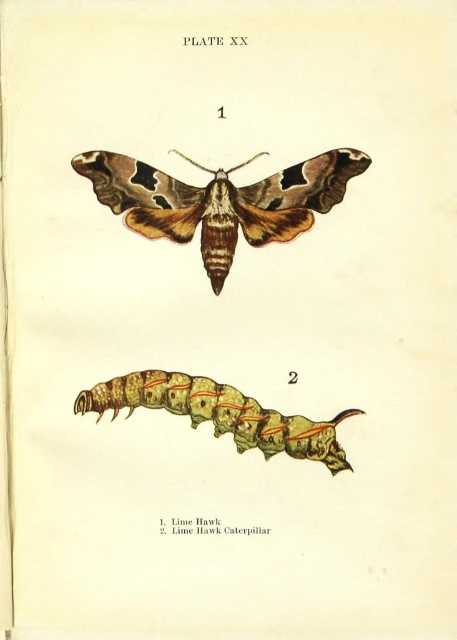
Question: Which point is closer to the camera taking this photo?

Choices:
 (A) (334, 454)
 (B) (270, 189)

Answer: (B)

Question: Is matte brown moth at center smaller than greenish-yellow textured caterpillar at bottom center?

Choices:
 (A) yes
 (B) no

Answer: (B)

Question: Can you confirm if matte brown moth at center is smaller than greenish-yellow textured caterpillar at bottom center?

Choices:
 (A) no
 (B) yes

Answer: (A)

Question: Is matte brown moth at center positioned behind greenish-yellow textured caterpillar at bottom center?

Choices:
 (A) yes
 (B) no

Answer: (B)

Question: Which of the following is the farthest from the observer?

Choices:
 (A) (275, 218)
 (B) (85, 406)

Answer: (B)

Question: Which point is closer to the camera taking this photo?

Choices:
 (A) (301, 193)
 (B) (80, 404)

Answer: (A)